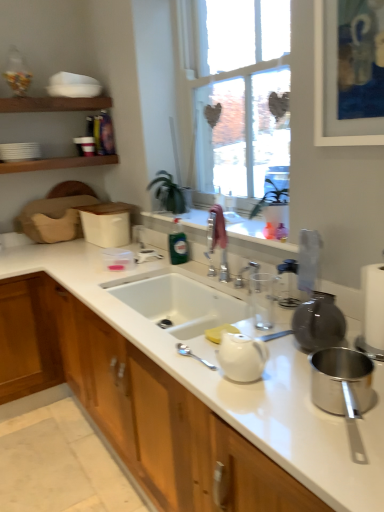
Question: Is clear plastic bag at upper right, acting as the 1th appliance starting from the top, located outside white glossy cabinet at center?

Choices:
 (A) no
 (B) yes

Answer: (B)

Question: Is clear plastic bag at upper right, which is counted as the first appliance, starting from the back, closer to the viewer compared to white glossy cabinet at center?

Choices:
 (A) yes
 (B) no

Answer: (B)

Question: Can you confirm if clear plastic bag at upper right, acting as the 1th appliance starting from the top, is smaller than white glossy cabinet at center?

Choices:
 (A) no
 (B) yes

Answer: (B)

Question: Considering the relative positions of clear plastic bag at upper right, which is counted as the first appliance, starting from the back, and white glossy cabinet at center in the image provided, is clear plastic bag at upper right, which is counted as the first appliance, starting from the back, to the left of white glossy cabinet at center from the viewer's perspective?

Choices:
 (A) no
 (B) yes

Answer: (A)

Question: Is clear plastic bag at upper right, the 2th appliance in the front-to-back sequence, further to camera compared to white glossy cabinet at center?

Choices:
 (A) no
 (B) yes

Answer: (B)

Question: From a real-world perspective, is clear plastic bag at upper right, the 2th appliance in the front-to-back sequence, physically located above or below white glossy teapot at center?

Choices:
 (A) above
 (B) below

Answer: (A)

Question: From their relative heights in the image, would you say clear plastic bag at upper right, which is counted as the first appliance, starting from the back, is taller or shorter than white glossy teapot at center?

Choices:
 (A) short
 (B) tall

Answer: (B)

Question: Relative to white glossy teapot at center, is clear plastic bag at upper right, the 2th appliance in the front-to-back sequence, in front or behind?

Choices:
 (A) behind
 (B) front

Answer: (A)

Question: Looking at the image, does clear plastic bag at upper right, acting as the 1th appliance starting from the top, seem bigger or smaller compared to white glossy teapot at center?

Choices:
 (A) small
 (B) big

Answer: (B)

Question: From a real-world perspective, is polished stainless steel pot at lower right, the second appliance viewed from the top, physically located above or below white ceramic sink at center?

Choices:
 (A) below
 (B) above

Answer: (B)

Question: In the image, is polished stainless steel pot at lower right, the second appliance viewed from the top, on the left side or the right side of white ceramic sink at center?

Choices:
 (A) left
 (B) right

Answer: (B)

Question: Is polished stainless steel pot at lower right, positioned as the 1th appliance in bottom-to-top order, in front of or behind white ceramic sink at center in the image?

Choices:
 (A) front
 (B) behind

Answer: (A)

Question: Is polished stainless steel pot at lower right, arranged as the second appliance when viewed from the back, bigger or smaller than white ceramic sink at center?

Choices:
 (A) small
 (B) big

Answer: (A)

Question: In terms of size, does green glass bottle at center appear bigger or smaller than clear plastic bag at upper right, the 2th appliance in the front-to-back sequence?

Choices:
 (A) small
 (B) big

Answer: (A)

Question: From a real-world perspective, is green glass bottle at center positioned above or below clear plastic bag at upper right, which is counted as the first appliance, starting from the back?

Choices:
 (A) below
 (B) above

Answer: (A)